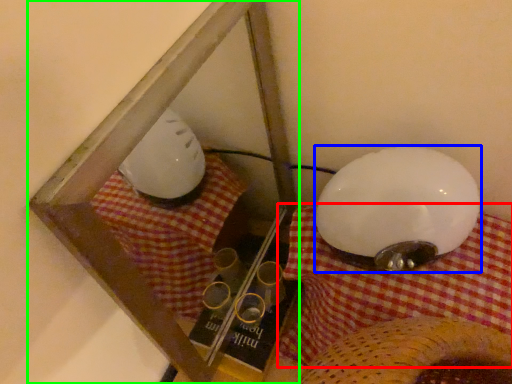
Question: Estimate the real-world distances between objects in this image. Which object is closer to blanket (highlighted by a red box), lamp (highlighted by a blue box) or glass box (highlighted by a green box)?

Choices:
 (A) lamp
 (B) glass box

Answer: (A)